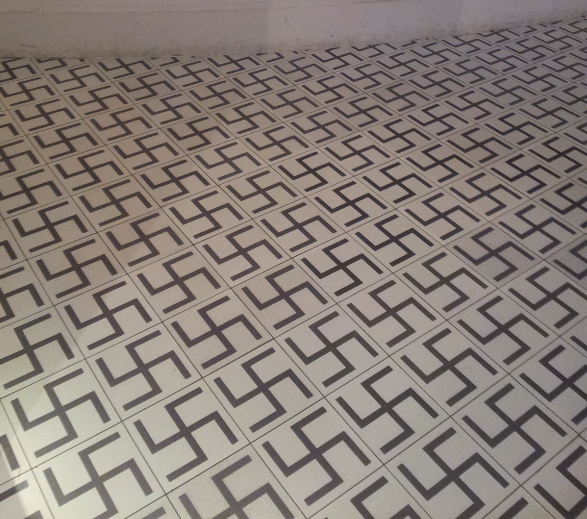
Where is `tile`? This screenshot has width=587, height=519. tile is located at coordinates (542, 153).